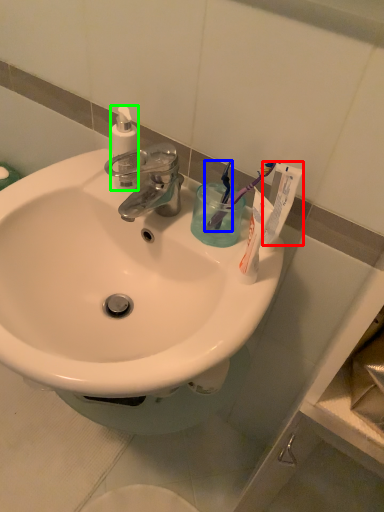
Question: Which object is positioned farthest from toothpaste (highlighted by a red box)? Select from toothbrush (highlighted by a blue box) and toiletry (highlighted by a green box).

Choices:
 (A) toothbrush
 (B) toiletry

Answer: (B)